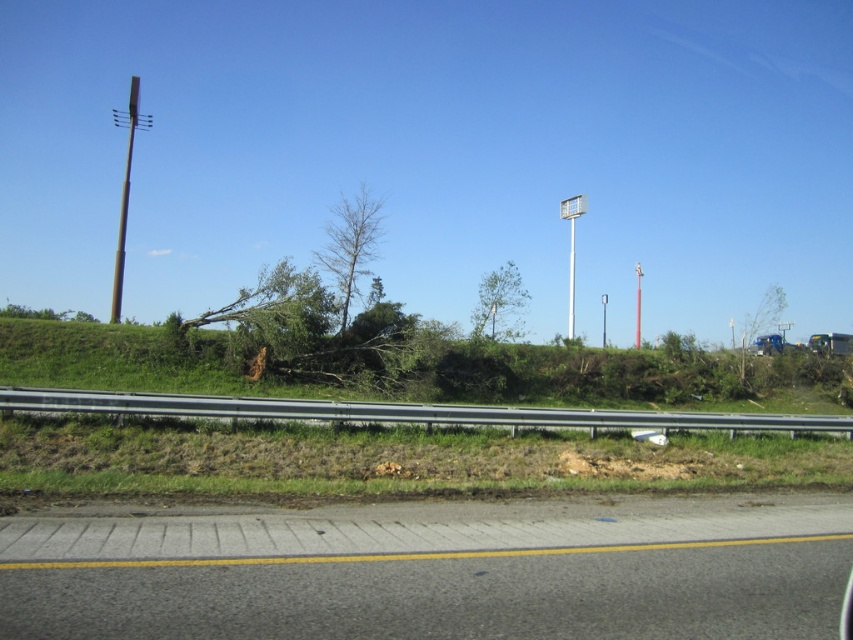
Is point (488, 296) positioned behind point (567, 314)?

No, (488, 296) is closer to viewer.

Does green leafy tree at center lie in front of metallic pole at center?

Yes, it is in front of metallic pole at center.

The height and width of the screenshot is (640, 853). What do you see at coordinates (498, 305) in the screenshot?
I see `green leafy tree at center` at bounding box center [498, 305].

What are the coordinates of `green leafy tree at center` in the screenshot? It's located at (498, 305).

Does silver metallic guardrail at center appear on the left side of metallic pole at center-right?

Yes, silver metallic guardrail at center is to the left of metallic pole at center-right.

This screenshot has height=640, width=853. What do you see at coordinates (405, 412) in the screenshot?
I see `silver metallic guardrail at center` at bounding box center [405, 412].

This screenshot has width=853, height=640. Describe the element at coordinates (405, 412) in the screenshot. I see `silver metallic guardrail at center` at that location.

Where is `silver metallic guardrail at center`? The width and height of the screenshot is (853, 640). silver metallic guardrail at center is located at coordinates (405, 412).

Does green leafy tree at center have a lesser width compared to green leafy tree at right?

Correct, green leafy tree at center's width is less than green leafy tree at right's.

Is green leafy tree at center bigger than green leafy tree at right?

No.

Between point (511, 308) and point (772, 352), which one is positioned in front?

Point (511, 308)

The width and height of the screenshot is (853, 640). Identify the location of green leafy tree at center. (498, 305).